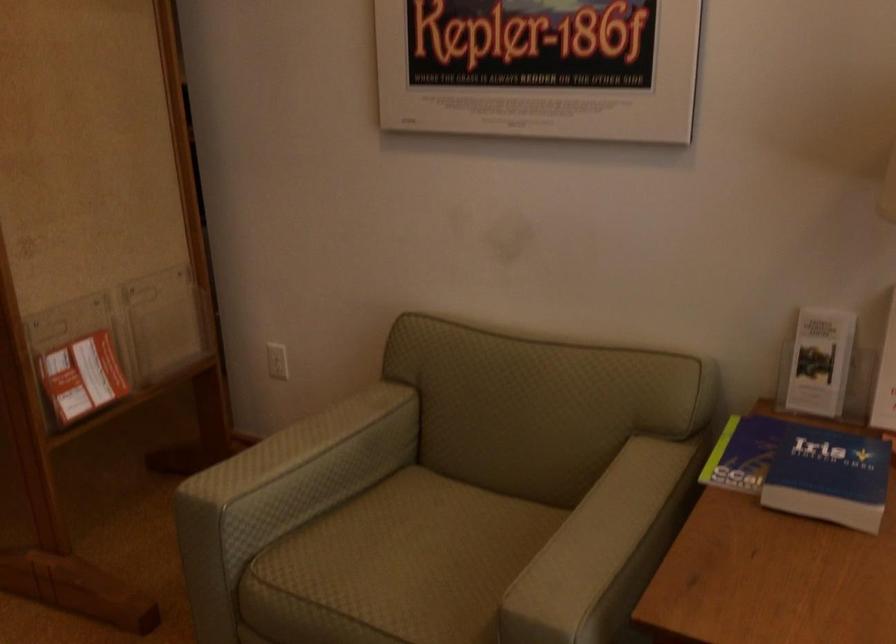
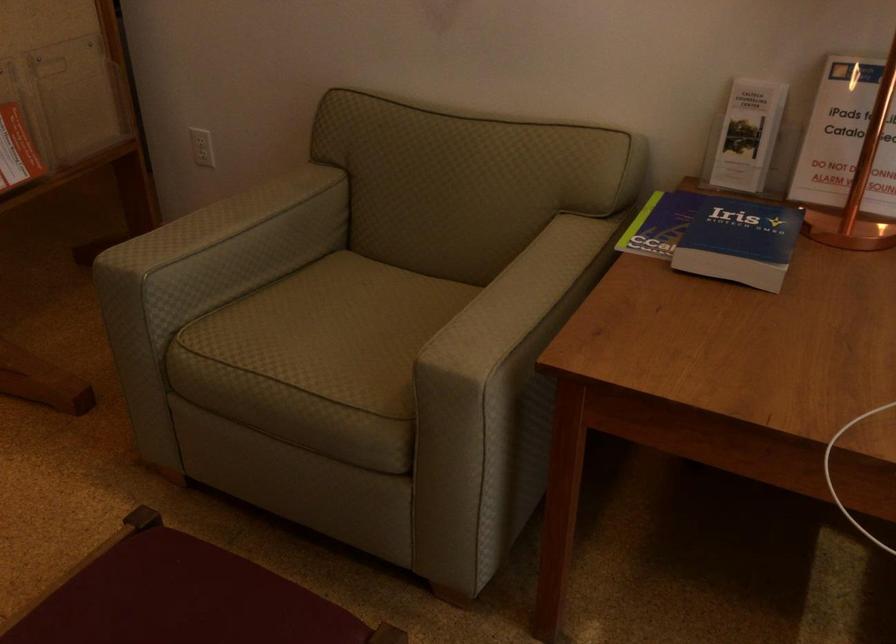
Where in the second image is the point corresponding to point 418,560 from the first image?

(343, 325)